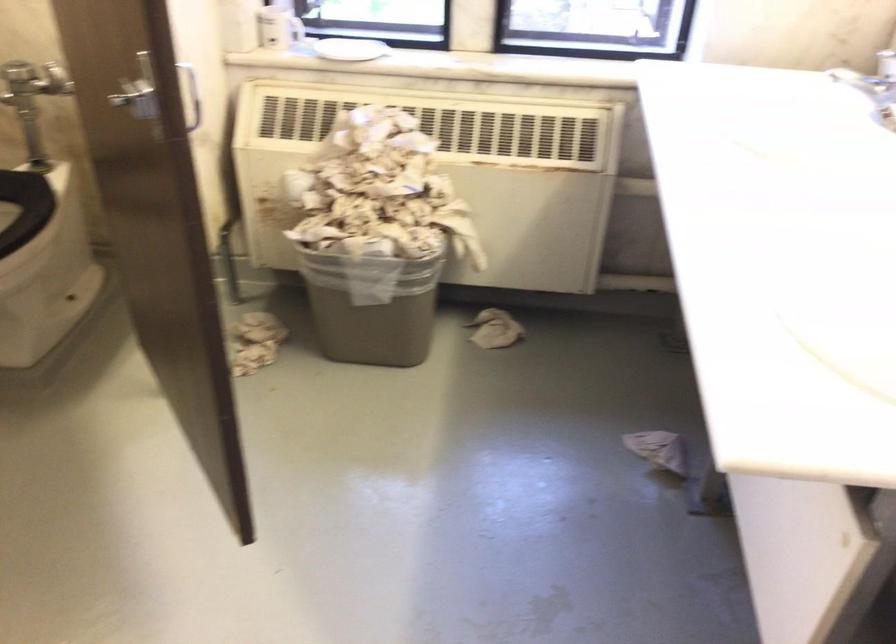
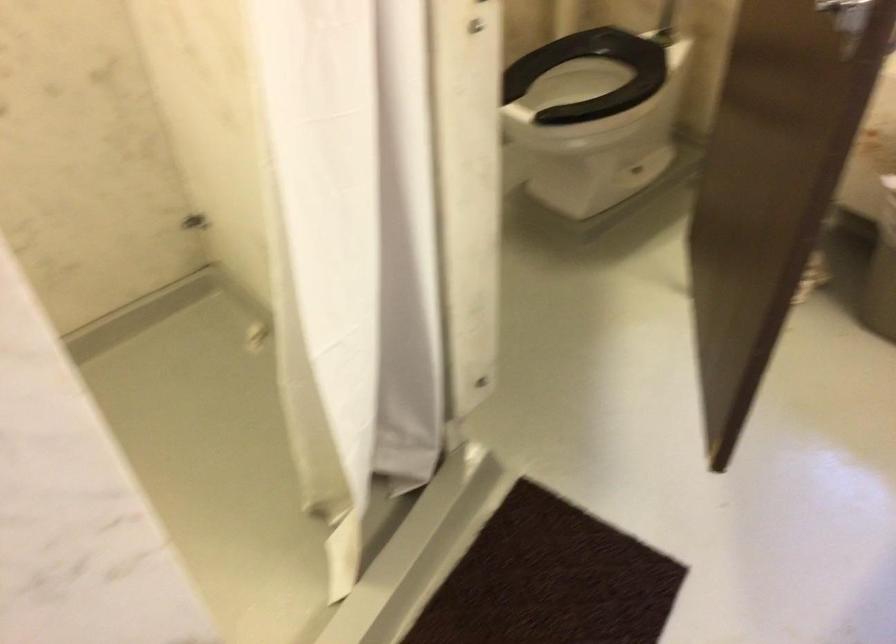
Where in the second image is the point corresponding to point (178, 114) from the first image?

(849, 14)